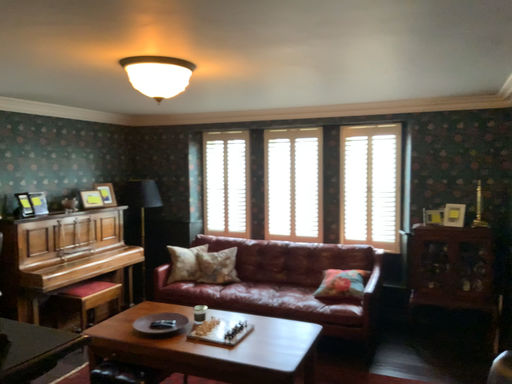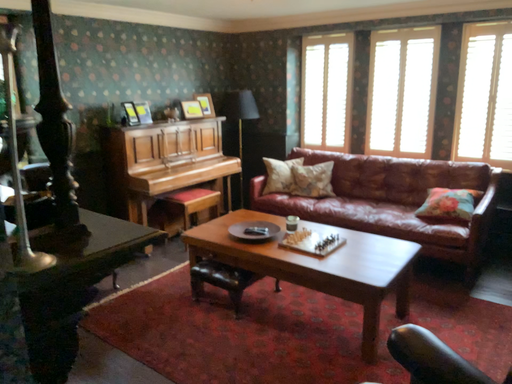
Question: How did the camera likely rotate when shooting the video?

Choices:
 (A) rotated right
 (B) rotated left

Answer: (B)